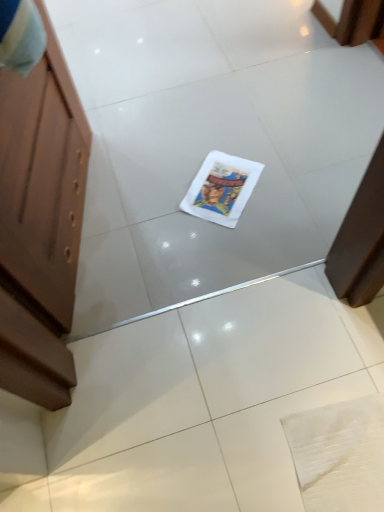
Question: Should I look upward or downward to see white paper comic book at center?

Choices:
 (A) up
 (B) down

Answer: (A)